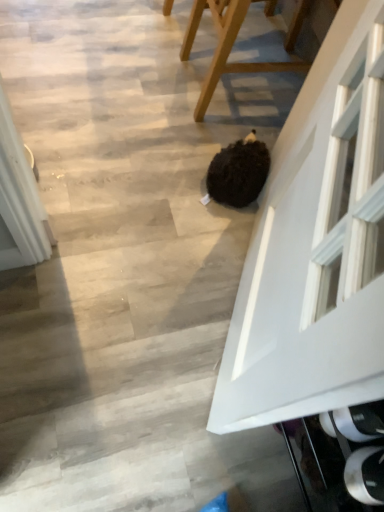
You are a GUI agent. You are given a task and a screenshot of the screen. Output one action in this format:
    pyautogui.click(x=<x>, y=<y>)
    Task: Click on the free space that is to the left of wooden chair at center
    
    Given the screenshot: What is the action you would take?
    pyautogui.click(x=145, y=59)